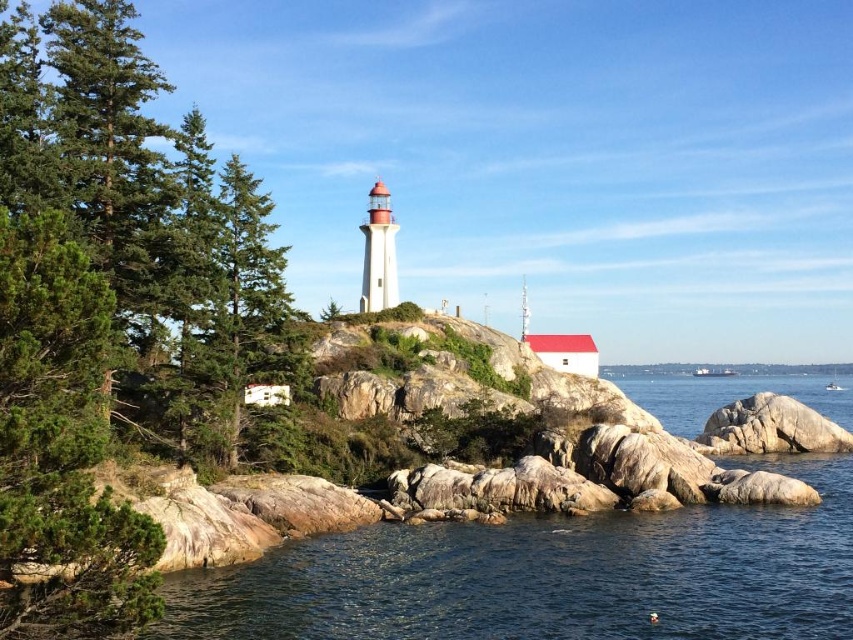
You are a drone operator trying to capture a photo of the lighthouse and the small white building with a red roof. Your drone is currently at the coordinates of the green matte tree at upper left. What direction should you move the drone to get a clear view of the lighthouse and the building?

The green matte tree at upper left is located at point (106, 307). To capture a clear view of the lighthouse and the small white building with a red roof, you should move the drone to the right and downward from the current position of the green matte tree at upper left.

You are a hiker who has just arrived at the coast and wants to cross from the gray rock at lower right to the clear water at lower left. Considering the terrain, can you safely walk directly between them?

The clear water at lower left is taller than gray rock at lower right, so the elevation difference may make it difficult to walk directly between them safely. You should look for a path with a gradual slope.

You are a hiker who wants to take a photo of the lighthouse and the green matte tree at upper left. You are standing at the point marked as point (106, 307). Can you see both the lighthouse and the green matte tree at upper left from your current position?

The green matte tree at upper left is located at point (106, 307), which is your current position. Therefore, you are standing right at the base of the green matte tree at upper left, so you can see the lighthouse but not the tree itself since you are at its location.